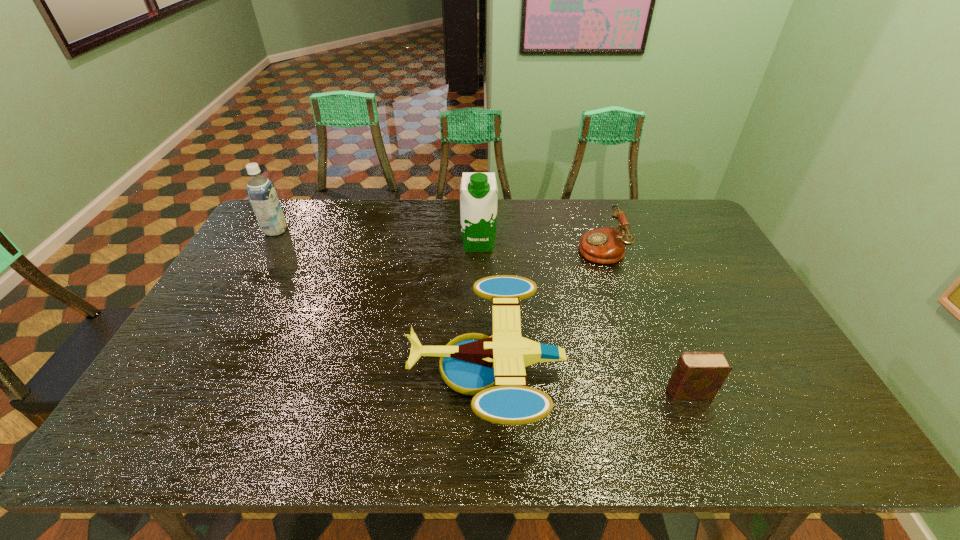
Identify the location of free space between the leftmost object and the diary. (482, 312).

The image size is (960, 540). I want to click on vacant space that is in between the drone and the diary, so click(588, 381).

Locate an element on the screen. free point between the diary and the left soya milk is located at coordinates (482, 312).

At what (x,y) coordinates should I click in order to perform the action: click on blank region between the drone and the right soya milk. Please return your answer as a coordinate pair (x, y). Looking at the image, I should click on (483, 306).

At what (x,y) coordinates should I click in order to perform the action: click on free space between the drone and the diary. Please return your answer as a coordinate pair (x, y). This screenshot has width=960, height=540. Looking at the image, I should click on (588, 381).

Find the location of a particular element. This screenshot has width=960, height=540. free space between the telephone and the right soya milk is located at coordinates (540, 246).

Locate an element on the screen. object that ranks as the fourth closest to the drone is located at coordinates (261, 192).

Identify which object is the third closest to the leftmost object. Please provide its 2D coordinates. Your answer should be formatted as a tuple, i.e. [(x, y)], where the tuple contains the x and y coordinates of a point satisfying the conditions above.

[(607, 245)]